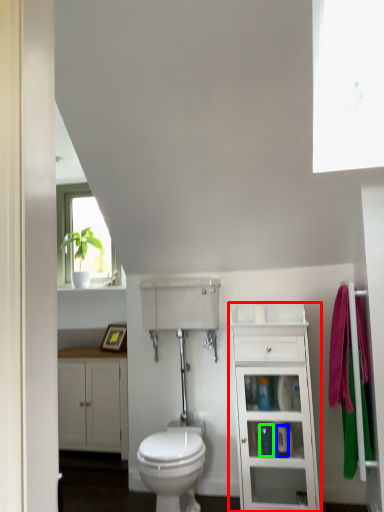
Question: Considering the real-world distances, which object is farthest from bathroom cabinet (highlighted by a red box)? toiletry (highlighted by a blue box) or toiletry (highlighted by a green box)?

Choices:
 (A) toiletry
 (B) toiletry

Answer: (A)